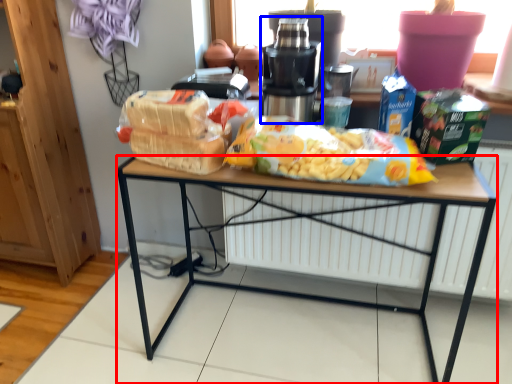
Question: Which object appears closest to the camera in this image, desk (highlighted by a red box) or tableware (highlighted by a blue box)?

Choices:
 (A) desk
 (B) tableware

Answer: (A)